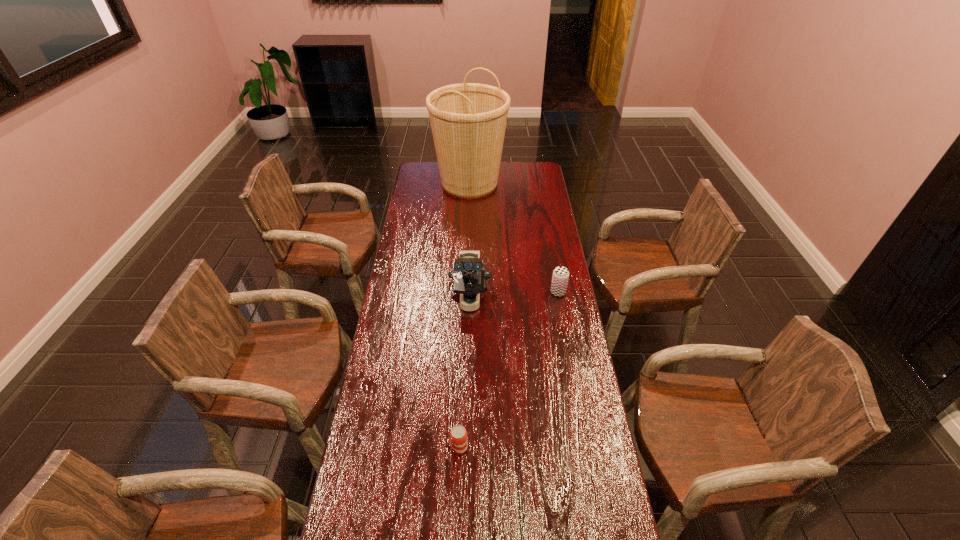
Find the location of `the farthest object`. the farthest object is located at coordinates (468, 120).

In order to click on the tallest object in this screenshot , I will do `click(468, 120)`.

You are a GUI agent. You are given a task and a screenshot of the screen. Output one action in this format:
    pyautogui.click(x=<x>, y=<y>)
    Task: Click on the microscope
    The width and height of the screenshot is (960, 540).
    Given the screenshot: What is the action you would take?
    pyautogui.click(x=469, y=277)

This screenshot has height=540, width=960. I want to click on the farther beer can, so click(560, 277).

Where is `the taller beer can`? the taller beer can is located at coordinates pos(560,277).

At what (x,y) coordinates should I click in order to perform the action: click on the shortest object. Please return your answer as a coordinate pair (x, y). The width and height of the screenshot is (960, 540). Looking at the image, I should click on (458, 435).

This screenshot has height=540, width=960. I want to click on the shorter beer can, so click(x=458, y=435).

The height and width of the screenshot is (540, 960). In order to click on free space located on the front of the tallest object in this screenshot , I will do `click(468, 233)`.

The height and width of the screenshot is (540, 960). What are the coordinates of `free point located through the eyepieces of the third shortest object` in the screenshot? It's located at (468, 413).

Where is `vacant space located 0.100m on the left of the taller beer can`? vacant space located 0.100m on the left of the taller beer can is located at coordinates (526, 292).